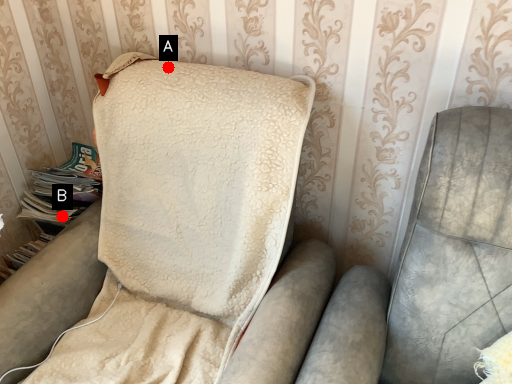
Question: Two points are circled on the image, labeled by A and B beside each circle. Which point is farther to the camera?

Choices:
 (A) A is further
 (B) B is further

Answer: (B)